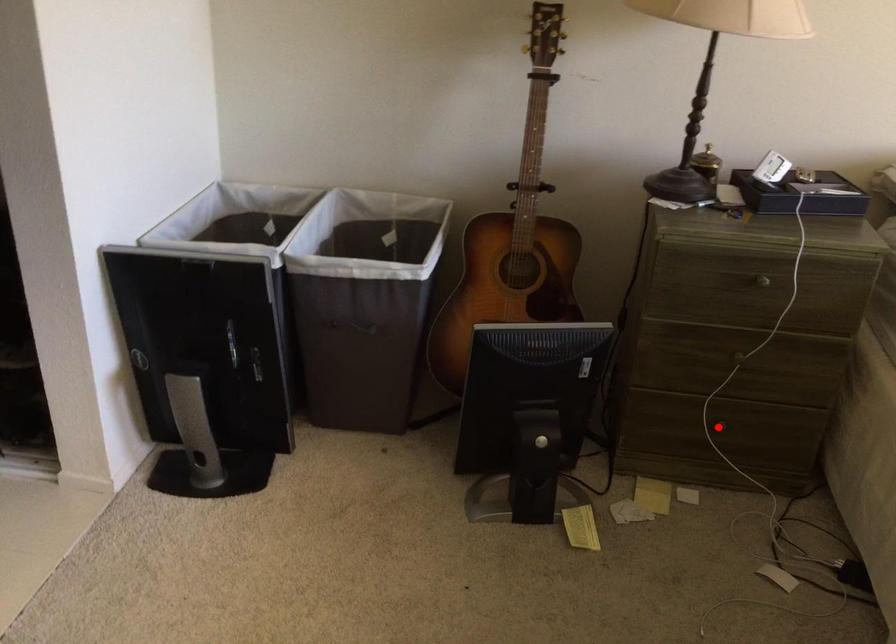
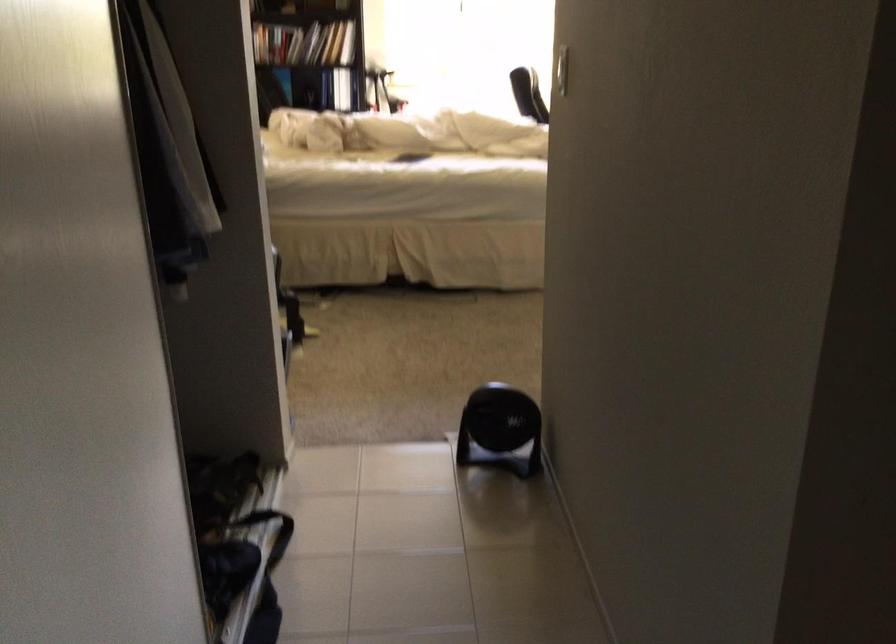
Question: I am providing you with two images of the same scene from different viewpoints. A red point is marked on the first image. Can you still see the location of the red point in image 2?

Choices:
 (A) Yes
 (B) No

Answer: (B)